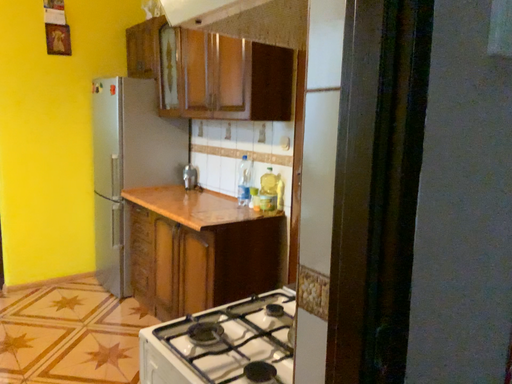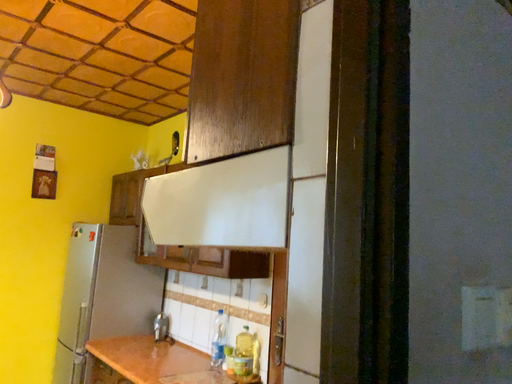
Question: How did the camera likely rotate when shooting the video?

Choices:
 (A) rotated downward
 (B) rotated upward

Answer: (B)